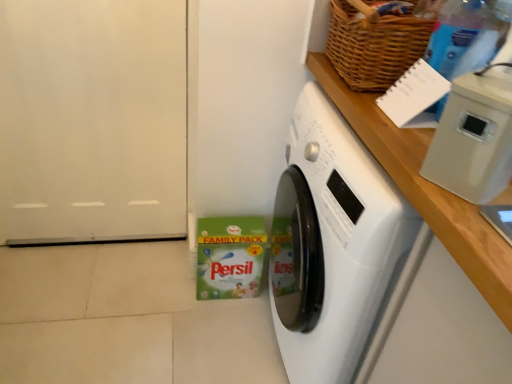
Question: Is white glossy washing machine at center shorter than white matte door at left?

Choices:
 (A) yes
 (B) no

Answer: (A)

Question: Can you confirm if white glossy washing machine at center is taller than white matte door at left?

Choices:
 (A) no
 (B) yes

Answer: (A)

Question: Does white glossy washing machine at center lie behind white matte door at left?

Choices:
 (A) yes
 (B) no

Answer: (B)

Question: From a real-world perspective, is white glossy washing machine at center below white matte door at left?

Choices:
 (A) no
 (B) yes

Answer: (B)

Question: Is white matte door at left surrounded by white glossy washing machine at center?

Choices:
 (A) no
 (B) yes

Answer: (A)

Question: Is woven brown basket at upper right situated inside transparent plastic bottle at upper right or outside?

Choices:
 (A) outside
 (B) inside

Answer: (A)

Question: Is woven brown basket at upper right in front of or behind transparent plastic bottle at upper right in the image?

Choices:
 (A) behind
 (B) front

Answer: (A)

Question: From their relative heights in the image, would you say woven brown basket at upper right is taller or shorter than transparent plastic bottle at upper right?

Choices:
 (A) tall
 (B) short

Answer: (B)

Question: Does point (402, 19) appear closer or farther from the camera than point (431, 61)?

Choices:
 (A) farther
 (B) closer

Answer: (A)

Question: Considering the positions of white plastic container at upper right and white glossy washing machine at center in the image, is white plastic container at upper right taller or shorter than white glossy washing machine at center?

Choices:
 (A) tall
 (B) short

Answer: (B)

Question: Based on their positions, is white plastic container at upper right located to the left or right of white glossy washing machine at center?

Choices:
 (A) left
 (B) right

Answer: (A)

Question: Considering the positions of white plastic container at upper right and white glossy washing machine at center in the image, is white plastic container at upper right wider or thinner than white glossy washing machine at center?

Choices:
 (A) thin
 (B) wide

Answer: (A)

Question: Is white plastic container at upper right situated inside white glossy washing machine at center or outside?

Choices:
 (A) inside
 (B) outside

Answer: (B)

Question: Considering the positions of white matte door at left and white glossy washing machine at center in the image, is white matte door at left wider or thinner than white glossy washing machine at center?

Choices:
 (A) thin
 (B) wide

Answer: (A)

Question: From the image's perspective, relative to white glossy washing machine at center, is white matte door at left above or below?

Choices:
 (A) above
 (B) below

Answer: (A)